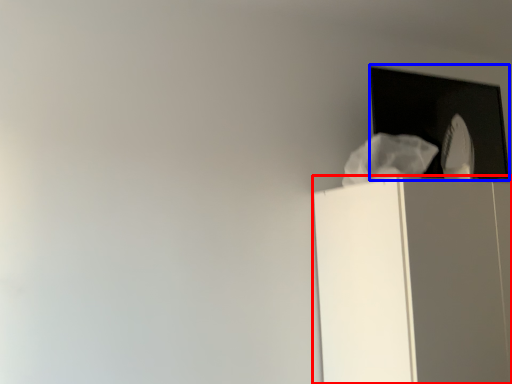
Question: Which of the following is the farthest to the observer, furniture (highlighted by a red box) or window (highlighted by a blue box)?

Choices:
 (A) furniture
 (B) window

Answer: (B)